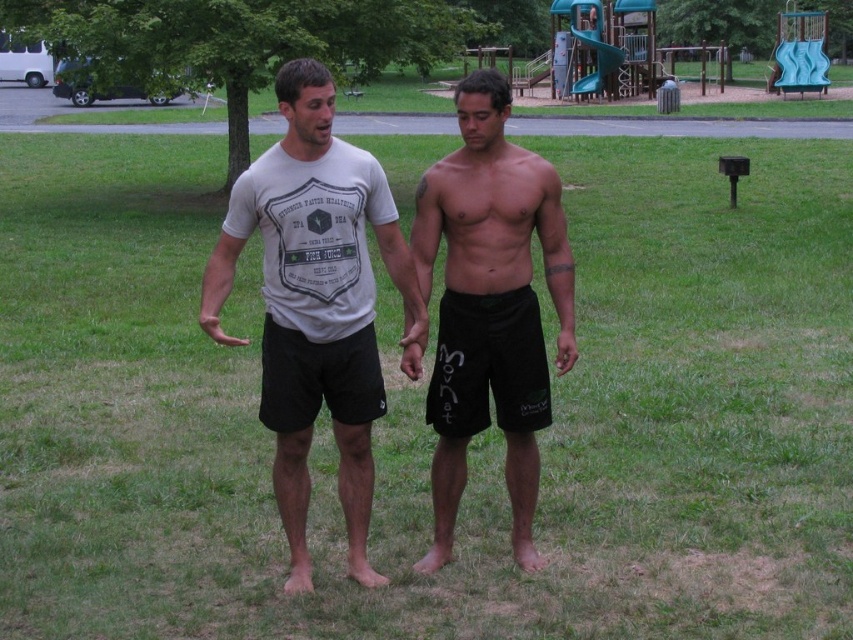
You are standing in the park and want to walk from the point at coordinates (386, 196) to the point at coordinates (532, 292). Which direction should you move relative to your current position?

You should move away from the camera because point (386, 196) is closer to the camera than point (532, 292). Since you are at the point closer to the camera, moving towards the farther point requires moving away from the camera.